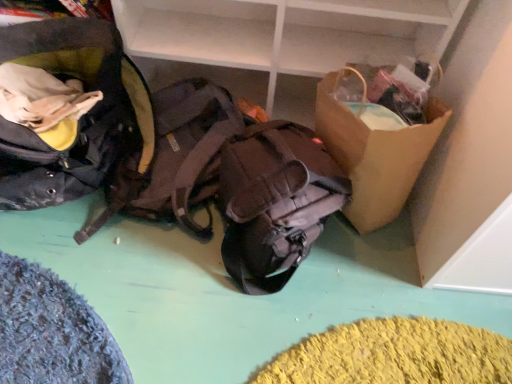
At what (x,y) coordinates should I click in order to perform the action: click on free point to the right of matte brown backpack at center, the third backpack in the left-to-right sequence. Please return your answer as a coordinate pair (x, y). The height and width of the screenshot is (384, 512). Looking at the image, I should click on (373, 284).